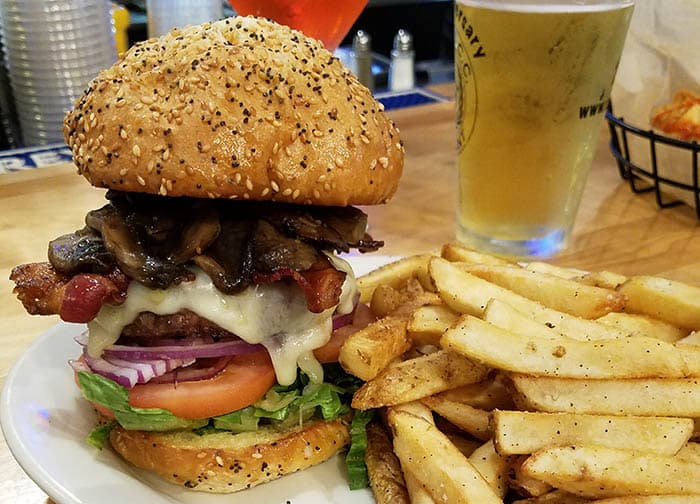
Locate an element on the screen. The width and height of the screenshot is (700, 504). metal basket is located at coordinates (650, 135).